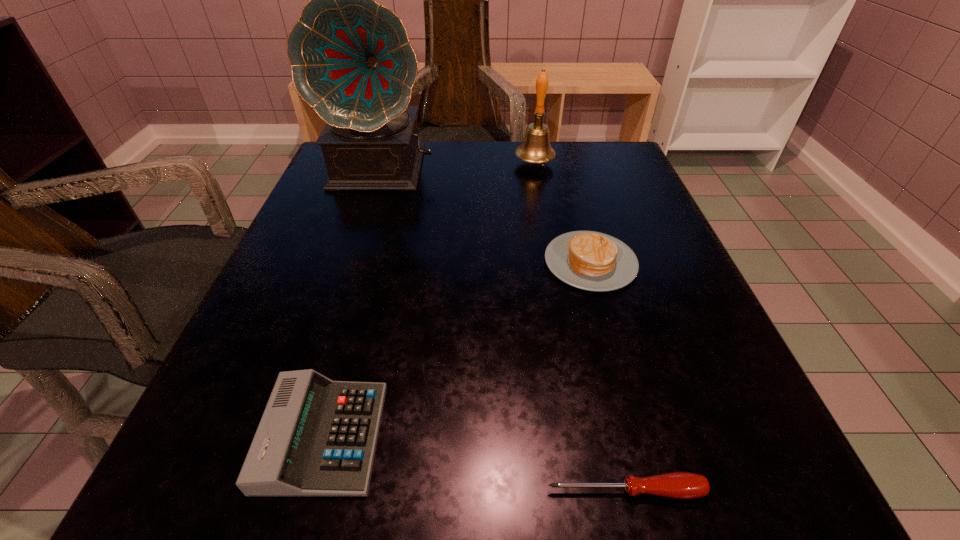
The image size is (960, 540). I want to click on vacant space that satisfies the following two spatial constraints: 1. on the horn of the pancake; 2. on the left side of the tallest object, so click(x=355, y=262).

The width and height of the screenshot is (960, 540). What are the coordinates of `free region that satisfies the following two spatial constraints: 1. on the horn of the record player; 2. on the right side of the third farthest object` in the screenshot? It's located at (355, 262).